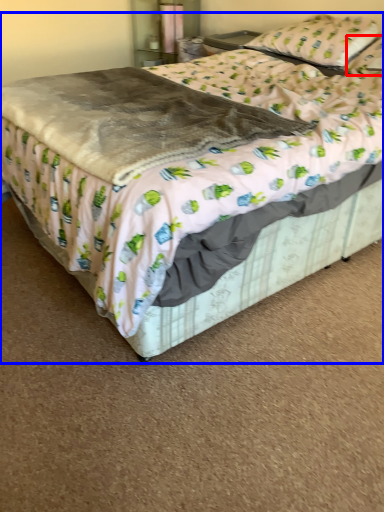
Question: Which object is closer to the camera taking this photo, pillow (highlighted by a red box) or bed (highlighted by a blue box)?

Choices:
 (A) pillow
 (B) bed

Answer: (B)